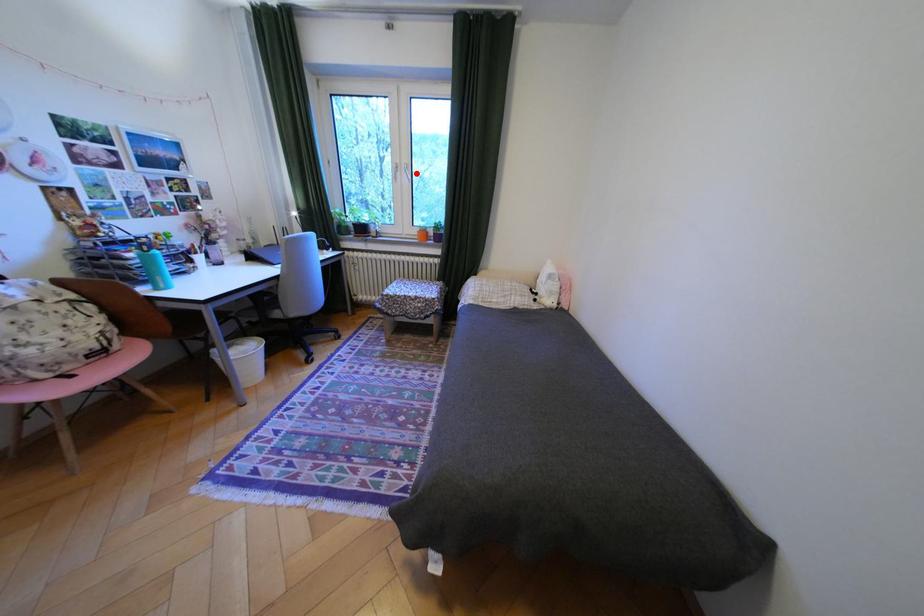
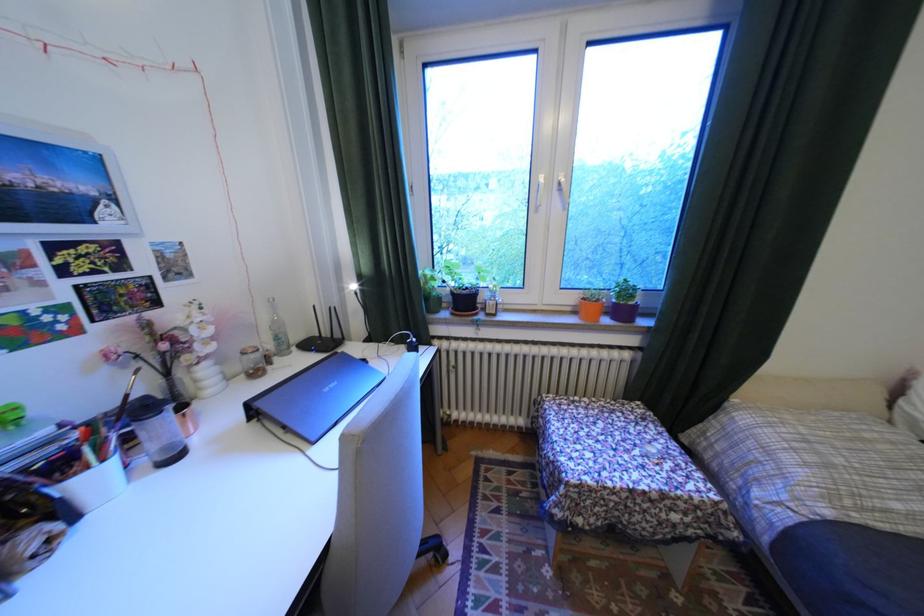
Question: A red point is marked in image1. In image2, is the corresponding 3D point closer to the camera or farther? Reply with the corresponding letter.

Choices:
 (A) The corresponding 3D point is closer.
 (B) The corresponding 3D point is farther.

Answer: (B)